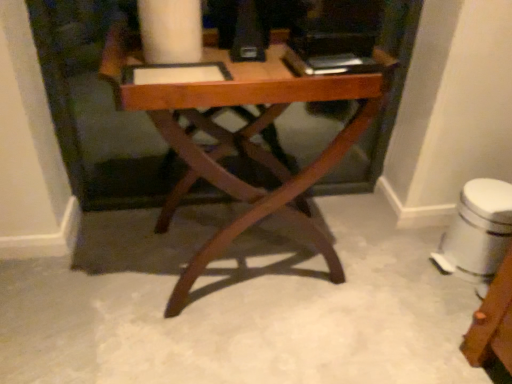
Find the location of `vacant space in front of wooden table at center`. vacant space in front of wooden table at center is located at coordinates (226, 341).